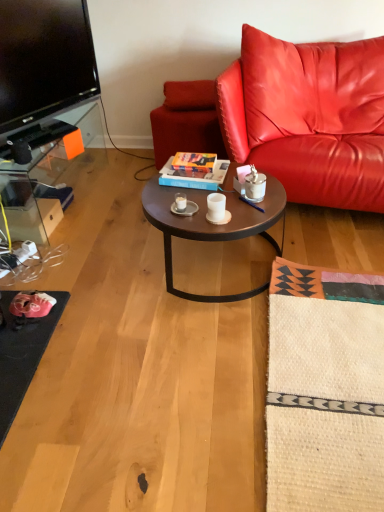
Image resolution: width=384 pixels, height=512 pixels. What are the coordinates of `free location to the right of white ceramic mug at center, which is the 1th coffee cup in back-to-front order` in the screenshot? It's located at (223, 205).